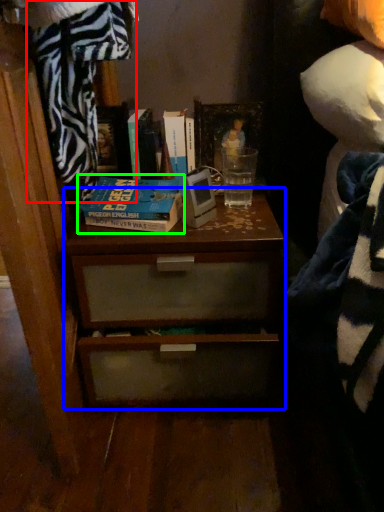
Question: Considering the real-world distances, which object is farthest from blanket (highlighted by a red box)? chest of drawers (highlighted by a blue box) or book (highlighted by a green box)?

Choices:
 (A) chest of drawers
 (B) book

Answer: (A)